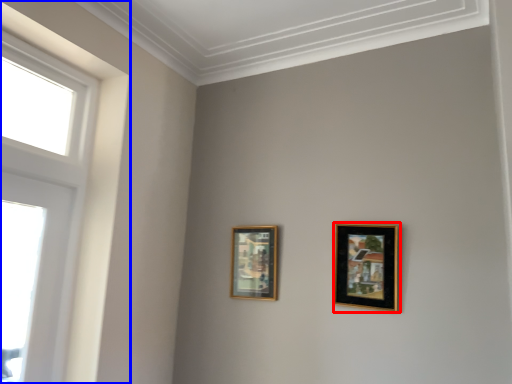
Question: Which of the following is the closest to the observer, picture frame (highlighted by a red box) or window (highlighted by a blue box)?

Choices:
 (A) picture frame
 (B) window

Answer: (B)